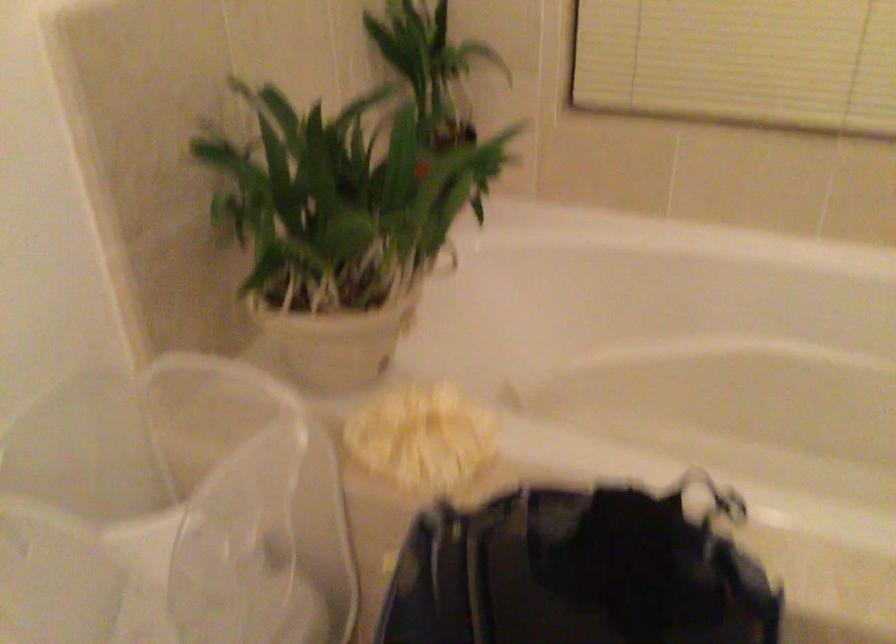
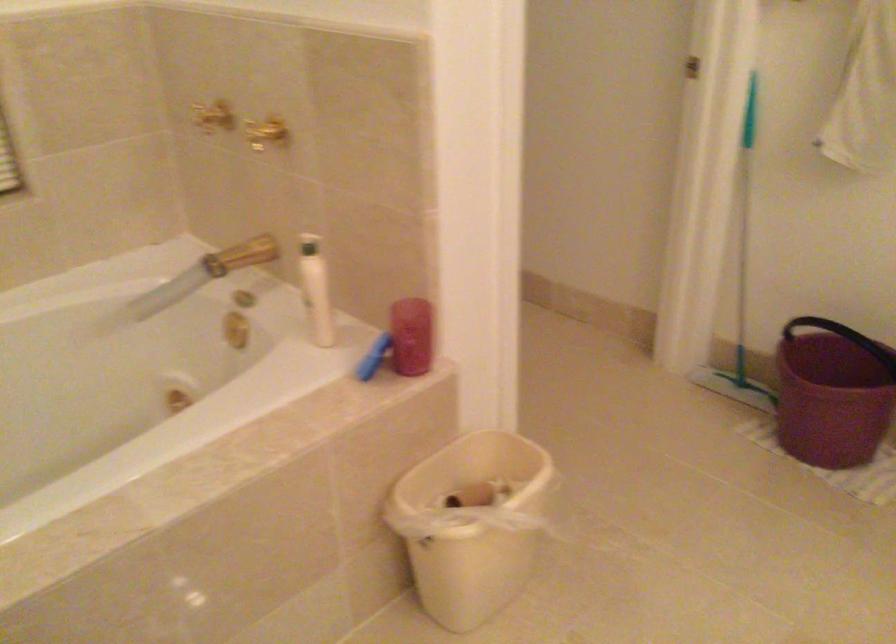
Question: Based on the continuous images, in which direction is the camera rotating? Reply with the corresponding letter.

Choices:
 (A) Left
 (B) Right
 (C) Up
 (D) Down

Answer: (B)